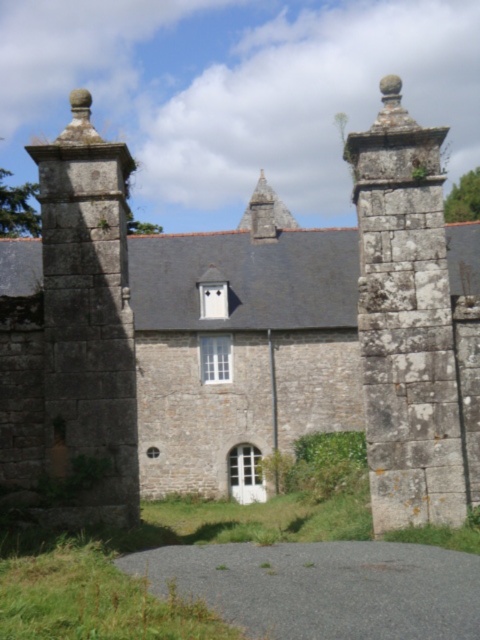
The image size is (480, 640). What do you see at coordinates (407, 323) in the screenshot?
I see `rusty stone gatepost at right` at bounding box center [407, 323].

Does rusty stone gatepost at right have a greater height compared to rustic stone tower at left?

Yes.

Which is behind, point (389, 321) or point (80, 140)?

Positioned behind is point (80, 140).

Where is `rusty stone gatepost at right`? Image resolution: width=480 pixels, height=640 pixels. rusty stone gatepost at right is located at coordinates (407, 323).